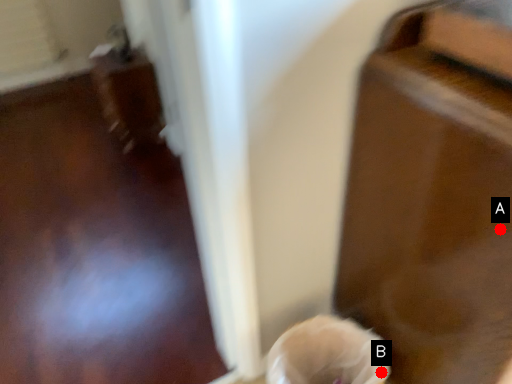
Question: Two points are circled on the image, labeled by A and B beside each circle. Which point is closer to the camera?

Choices:
 (A) A is closer
 (B) B is closer

Answer: (A)